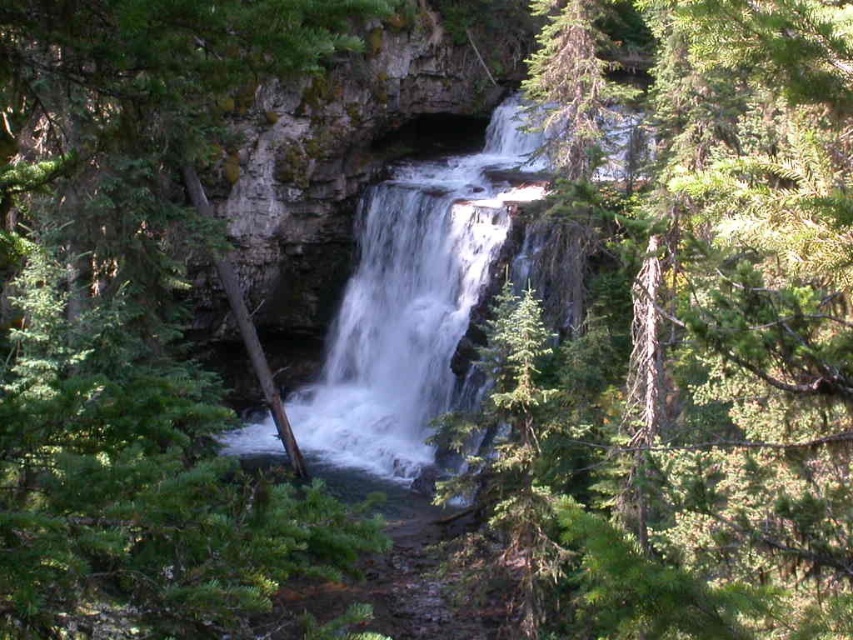
Can you confirm if green textured tree at center is positioned above white frothy water at center?

Incorrect, green textured tree at center is not positioned above white frothy water at center.

Locate an element on the screen. The image size is (853, 640). green textured tree at center is located at coordinates (691, 355).

Where is `green textured tree at center`? The width and height of the screenshot is (853, 640). green textured tree at center is located at coordinates (691, 355).

Identify the location of green textured tree at center. (691, 355).

Between green textured tree at center and green leafy tree at center, which one is positioned lower?

green leafy tree at center is lower down.

The width and height of the screenshot is (853, 640). What are the coordinates of `green textured tree at center` in the screenshot? It's located at (691, 355).

Locate an element on the screen. The width and height of the screenshot is (853, 640). green textured tree at center is located at coordinates (691, 355).

Which is in front, point (94, 454) or point (422, 317)?

Point (94, 454) is more forward.

Who is taller, green leafy tree at center or white frothy water at center?

white frothy water at center

Locate an element on the screen. The height and width of the screenshot is (640, 853). green leafy tree at center is located at coordinates (129, 321).